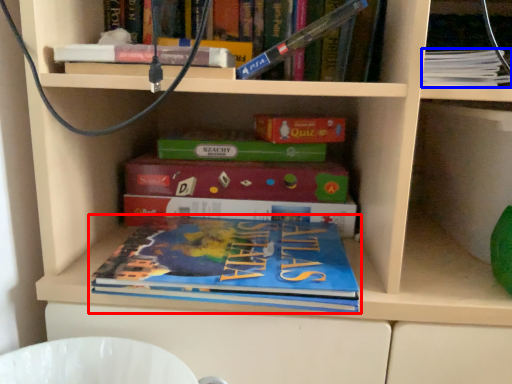
Question: Which object is further to the camera taking this photo, book (highlighted by a red box) or book (highlighted by a blue box)?

Choices:
 (A) book
 (B) book

Answer: (B)